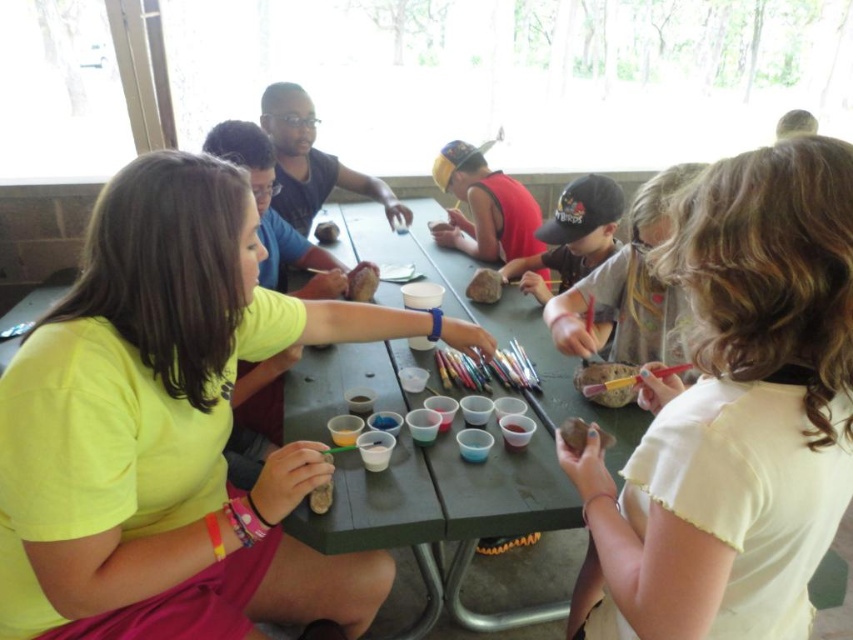
I want to click on green matte picnic table at center, so click(x=454, y=444).

Who is more forward, (375, 483) or (316, 502)?

Point (316, 502) is in front.

Which is in front, point (381, 401) or point (329, 504)?

Positioned in front is point (329, 504).

This screenshot has width=853, height=640. Find the location of `green matte picnic table at center`. green matte picnic table at center is located at coordinates (454, 444).

Is point (357, 484) positioned behind point (496, 237)?

No, it is not.

Can you confirm if green matte picnic table at center is positioned to the right of matte red tank top at center?

Incorrect, green matte picnic table at center is not on the right side of matte red tank top at center.

What do you see at coordinates (454, 444) in the screenshot? The height and width of the screenshot is (640, 853). I see `green matte picnic table at center` at bounding box center [454, 444].

The width and height of the screenshot is (853, 640). Find the location of `green matte picnic table at center`. green matte picnic table at center is located at coordinates (454, 444).

Can you confirm if matte red tank top at center is positioned to the left of matte brown rock at lower center?

No, matte red tank top at center is not to the left of matte brown rock at lower center.

The image size is (853, 640). What do you see at coordinates (485, 208) in the screenshot?
I see `matte red tank top at center` at bounding box center [485, 208].

Find the location of a particular element. The image size is (853, 640). matte red tank top at center is located at coordinates (485, 208).